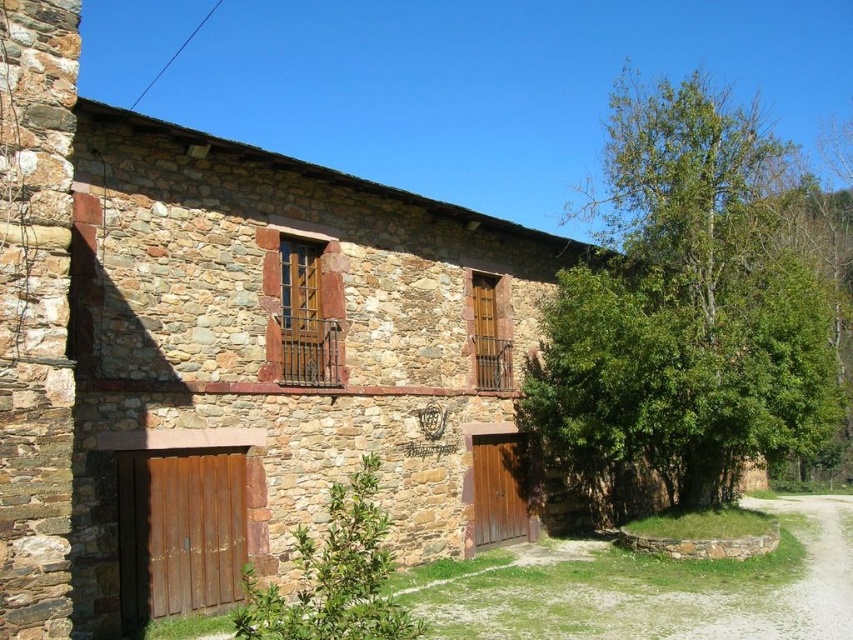
Does brown stone barn at center appear on the left side of green leafy tree at right?

Indeed, brown stone barn at center is positioned on the left side of green leafy tree at right.

Where is `brown stone barn at center`? brown stone barn at center is located at coordinates (229, 353).

Which is in front, point (224, 202) or point (741, 172)?

Point (224, 202) is in front.

Identify the location of brown stone barn at center. (229, 353).